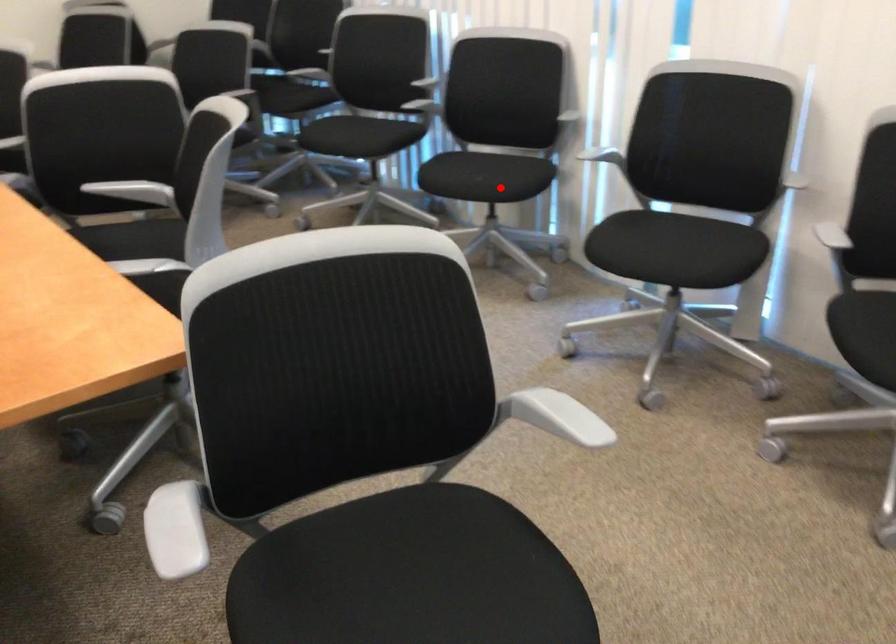
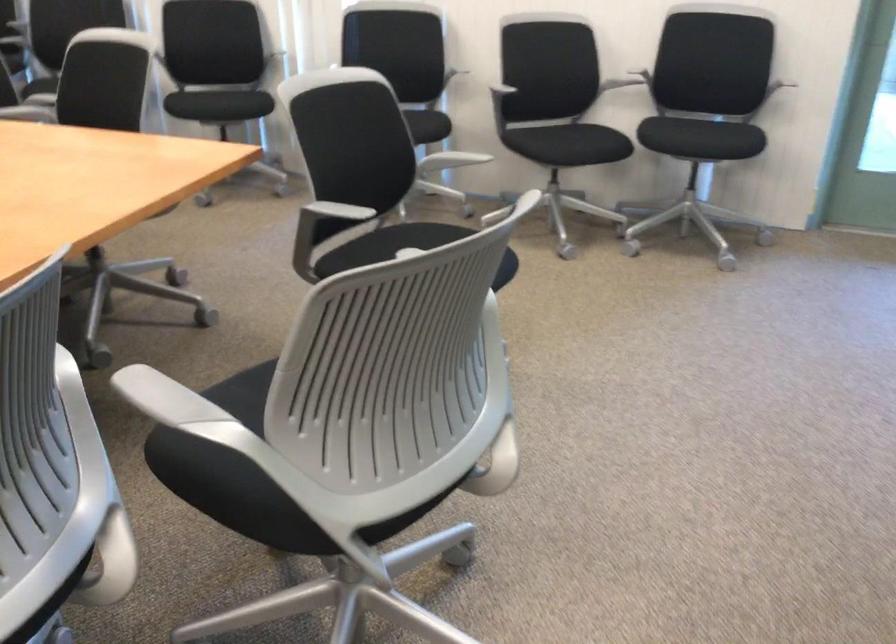
Question: A red point is marked in image1. In image2, is the corresponding 3D point closer to the camera or farther? Reply with the corresponding letter.

Choices:
 (A) The corresponding 3D point is closer.
 (B) The corresponding 3D point is farther.

Answer: (B)